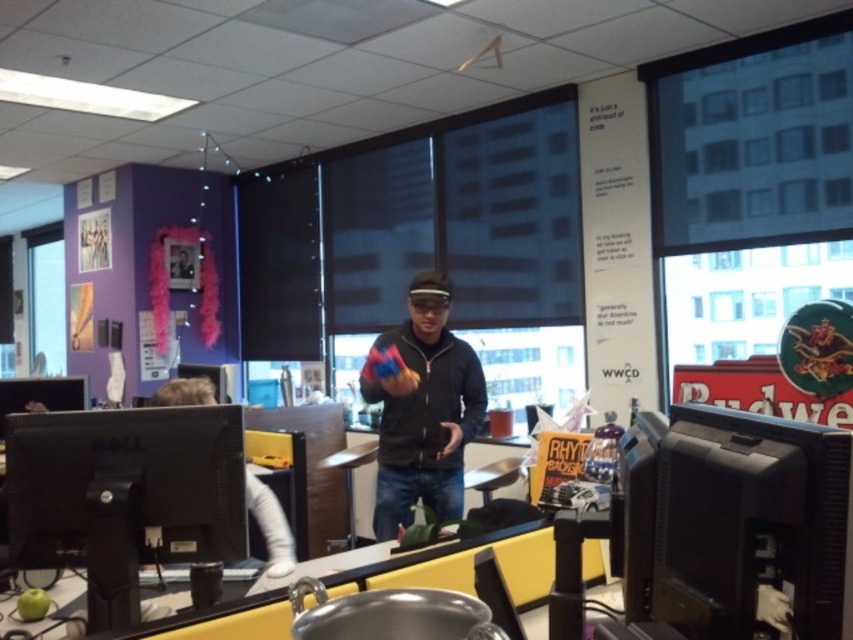
Which is in front, point (750, 513) or point (200, 404)?

Point (750, 513) is in front.

Is black matte monitor at right wider than white matte monitor at left?

No.

Between point (677, 614) and point (254, 496), which one is positioned in front?

Point (677, 614)

At what (x,y) coordinates should I click in order to perform the action: click on black matte monitor at right. Please return your answer as a coordinate pair (x, y). This screenshot has height=640, width=853. Looking at the image, I should click on (749, 524).

Who is higher up, black matte monitor at left or white matte monitor at left?

black matte monitor at left

Does point (123, 474) come closer to viewer compared to point (206, 381)?

Yes, point (123, 474) is closer to viewer.

The image size is (853, 640). I want to click on black matte monitor at left, so click(x=125, y=496).

What do you see at coordinates (749, 524) in the screenshot? Image resolution: width=853 pixels, height=640 pixels. I see `black matte monitor at right` at bounding box center [749, 524].

Who is shorter, black matte monitor at right or black matte jacket at center?

black matte monitor at right is shorter.

Locate an element on the screen. black matte monitor at right is located at coordinates (749, 524).